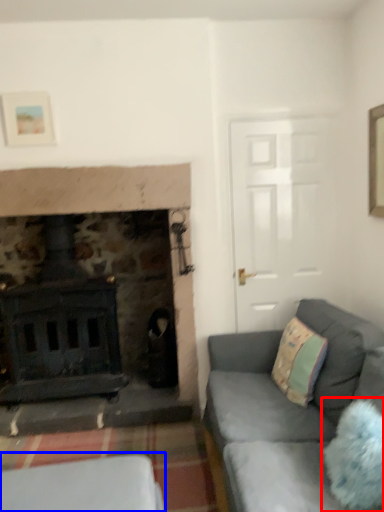
Question: Which point is closer to the camera, pillow (highlighted by a red box) or furniture (highlighted by a blue box)?

Choices:
 (A) pillow
 (B) furniture

Answer: (A)